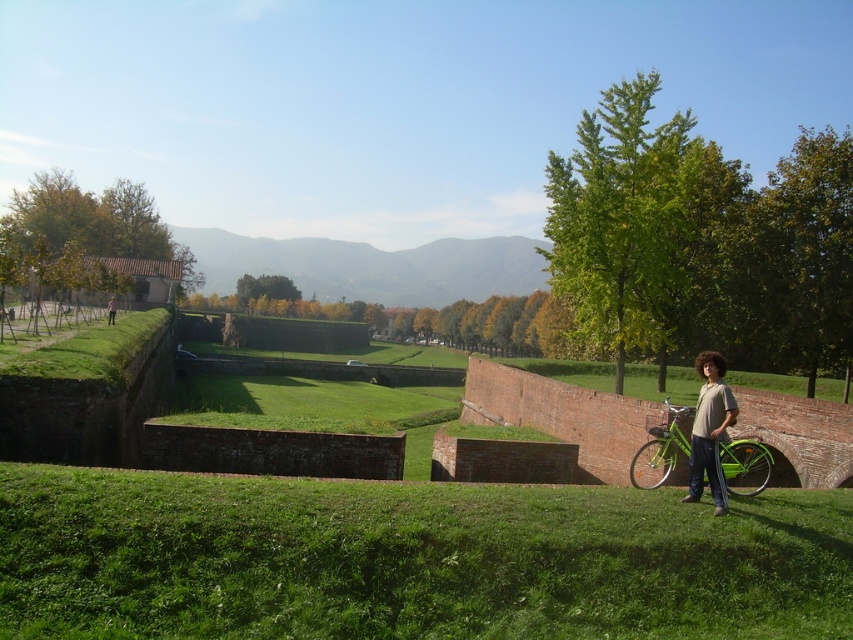
Image resolution: width=853 pixels, height=640 pixels. Identify the location of green grassy at lower center. (409, 560).

Measure the distance between green grassy hillside at center and camera.

green grassy hillside at center and camera are 272.52 meters apart.

Does green grassy hillside at center appear under light brown cotton shirt at lower right?

Actually, green grassy hillside at center is above light brown cotton shirt at lower right.

Who is more distant from viewer, (268, 243) or (711, 433)?

Positioned behind is point (268, 243).

The height and width of the screenshot is (640, 853). I want to click on green grassy hillside at center, so click(372, 266).

Who is higher up, green grassy hillside at center or green matte bicycle at lower right?

green grassy hillside at center

Can you confirm if green grassy hillside at center is thinner than green matte bicycle at lower right?

In fact, green grassy hillside at center might be wider than green matte bicycle at lower right.

Does point (405, 301) come farther from viewer compared to point (643, 452)?

Yes, it is.

This screenshot has width=853, height=640. What are the coordinates of `green grassy hillside at center` in the screenshot? It's located at (x=372, y=266).